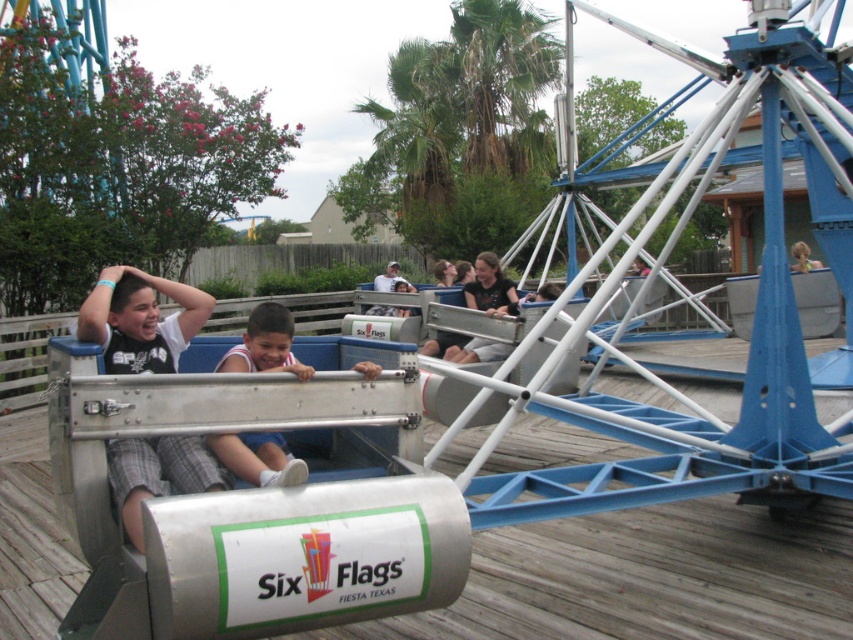
You are standing in front of the spinning ride at Six Flags Fiesta Texas and see the matte black shirt at left and the white jersey at center. Which rider is positioned more to the left side of the ride?

The matte black shirt at left is positioned more to the left side of the ride than the white jersey at center.

You are a photographer at Six Flags Fiesta Texas trying to capture a photo of the matte black shirt at left and the white jersey at center. If you want to ensure both are visible in the frame, which one should you focus on first?

You should focus on the matte black shirt at left first because it is in front of the white jersey at center, so it will be the primary subject in the foreground.

You are a photographer at Six Flags Fiesta Texas. You want to take a photo of the matte black shirt at left and the white jersey at center so that both are clearly visible. Given their sizes, which one should you focus on to ensure both are in frame?

Since the matte black shirt at left is smaller than the white jersey at center, you should focus on the white jersey at center to ensure both are in frame as it takes up more space and will be easier to capture clearly.